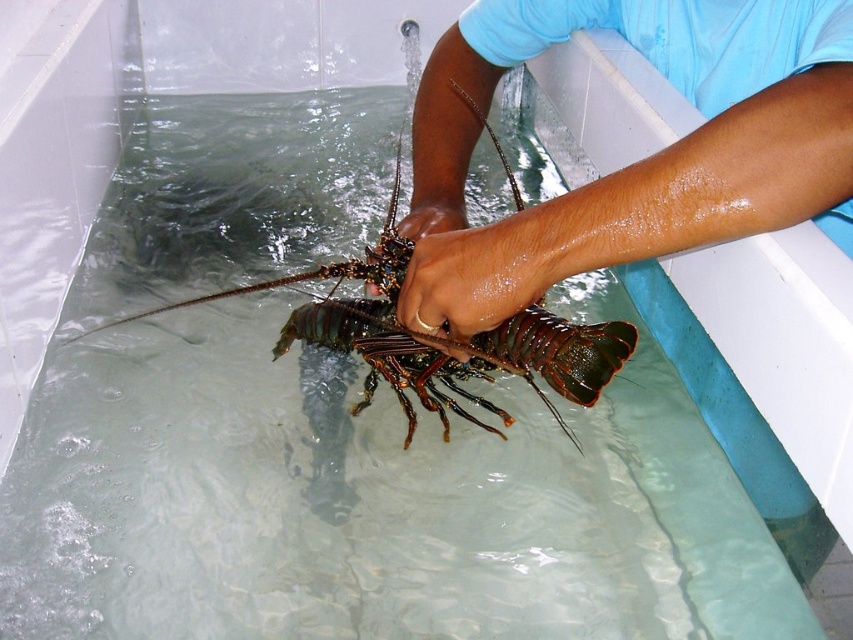
Question: Considering the relative positions of smooth skin hands at center and smooth skin hand at center in the image provided, where is smooth skin hands at center located with respect to smooth skin hand at center?

Choices:
 (A) right
 (B) left

Answer: (A)

Question: Among these objects, which one is nearest to the camera?

Choices:
 (A) shiny metallic lobster at center
 (B) smooth skin hand at center
 (C) glossy brown hand at center
 (D) smooth skin hands at center

Answer: (D)

Question: Which object appears farthest from the camera in this image?

Choices:
 (A) smooth skin hand at center
 (B) glossy brown hand at center

Answer: (A)

Question: Does smooth skin hands at center come in front of glossy brown hand at center?

Choices:
 (A) no
 (B) yes

Answer: (B)

Question: Based on their relative distances, which object is farther from the smooth skin hand at center?

Choices:
 (A) smooth skin hands at center
 (B) glossy brown hand at center
 (C) shiny metallic lobster at center

Answer: (A)

Question: Does smooth skin hands at center appear under smooth skin hand at center?

Choices:
 (A) yes
 (B) no

Answer: (B)